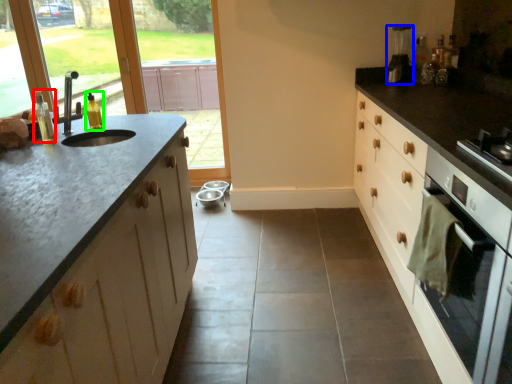
Question: Which object is the farthest from bottle (highlighted by a red box)? Choose among these: coffee machine (highlighted by a blue box) or bottle (highlighted by a green box).

Choices:
 (A) coffee machine
 (B) bottle

Answer: (A)